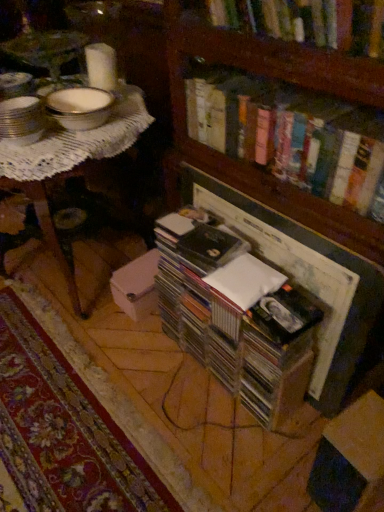
Question: Does cardboard box at lower right appear on the right side of hardcover books at upper center, arranged as the 2th book when viewed from the top?

Choices:
 (A) yes
 (B) no

Answer: (A)

Question: Considering the relative sizes of cardboard box at lower right and hardcover books at upper center, arranged as the 2th book when viewed from the top, in the image provided, is cardboard box at lower right bigger than hardcover books at upper center, arranged as the 2th book when viewed from the top,?

Choices:
 (A) yes
 (B) no

Answer: (B)

Question: Is cardboard box at lower right aimed at hardcover books at upper center, arranged as the 2th book when viewed from the top?

Choices:
 (A) no
 (B) yes

Answer: (A)

Question: From a real-world perspective, is cardboard box at lower right positioned over hardcover books at upper center, arranged as the 2th book when viewed from the top, based on gravity?

Choices:
 (A) no
 (B) yes

Answer: (A)

Question: Can you confirm if cardboard box at lower right is wider than hardcover books at upper center, marked as the 2th book in a bottom-to-top arrangement?

Choices:
 (A) no
 (B) yes

Answer: (B)

Question: Considering the positions of cardboard box at lower right and wooden bookcase at center in the image, is cardboard box at lower right wider or thinner than wooden bookcase at center?

Choices:
 (A) wide
 (B) thin

Answer: (B)

Question: Does point (362, 441) appear closer or farther from the camera than point (175, 7)?

Choices:
 (A) farther
 (B) closer

Answer: (B)

Question: From the image's perspective, is cardboard box at lower right positioned above or below wooden bookcase at center?

Choices:
 (A) above
 (B) below

Answer: (B)

Question: Is cardboard box at lower right taller or shorter than wooden bookcase at center?

Choices:
 (A) tall
 (B) short

Answer: (B)

Question: Looking at the image, does white lace table at upper left seem bigger or smaller compared to clear plastic case at center, which is the 1th book in bottom-to-top order?

Choices:
 (A) small
 (B) big

Answer: (B)

Question: Visually, is white lace table at upper left positioned to the left or to the right of clear plastic case at center, which is the 1th book in bottom-to-top order?

Choices:
 (A) left
 (B) right

Answer: (A)

Question: From a real-world perspective, relative to clear plastic case at center, which is the 1th book in bottom-to-top order, is white lace table at upper left vertically above or below?

Choices:
 (A) below
 (B) above

Answer: (B)

Question: From the image's perspective, relative to clear plastic case at center, which is the 1th book in bottom-to-top order, is white lace table at upper left above or below?

Choices:
 (A) above
 (B) below

Answer: (A)

Question: Do you think hardcover books at upper center, arranged as the 2th book when viewed from the top, is within white lace table at upper left, or outside of it?

Choices:
 (A) inside
 (B) outside

Answer: (B)

Question: From the image's perspective, is hardcover books at upper center, arranged as the 2th book when viewed from the top, located above or below white lace table at upper left?

Choices:
 (A) above
 (B) below

Answer: (A)